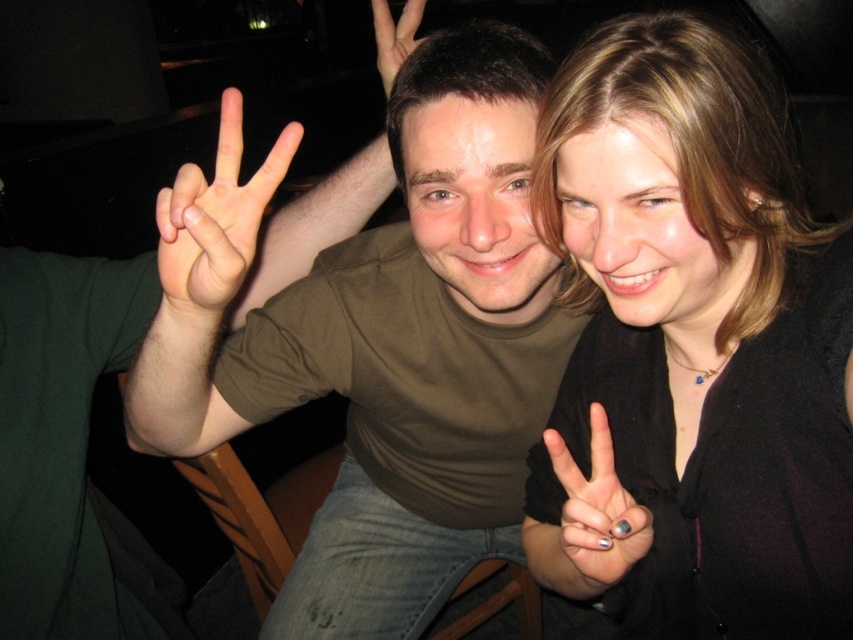
Question: Does matte green shirt at center appear on the left side of matte skin hand at upper center?

Choices:
 (A) no
 (B) yes

Answer: (B)

Question: Is matte black sweater at upper right positioned before matte skin hand at center?

Choices:
 (A) yes
 (B) no

Answer: (B)

Question: Is matte green shirt at center below nail polish painted fingernails at right?

Choices:
 (A) no
 (B) yes

Answer: (A)

Question: Among these objects, which one is farthest from the camera?

Choices:
 (A) nail polish painted fingernails at right
 (B) matte black sweater at upper right
 (C) matte skin hand at center

Answer: (B)

Question: Among these points, which one is farthest from the camera?

Choices:
 (A) (563, 442)
 (B) (374, 35)
 (C) (663, 68)
 (D) (200, 241)

Answer: (B)

Question: Which of the following is the closest to the observer?

Choices:
 (A) matte skin hand at center
 (B) matte skin hand at upper center

Answer: (A)